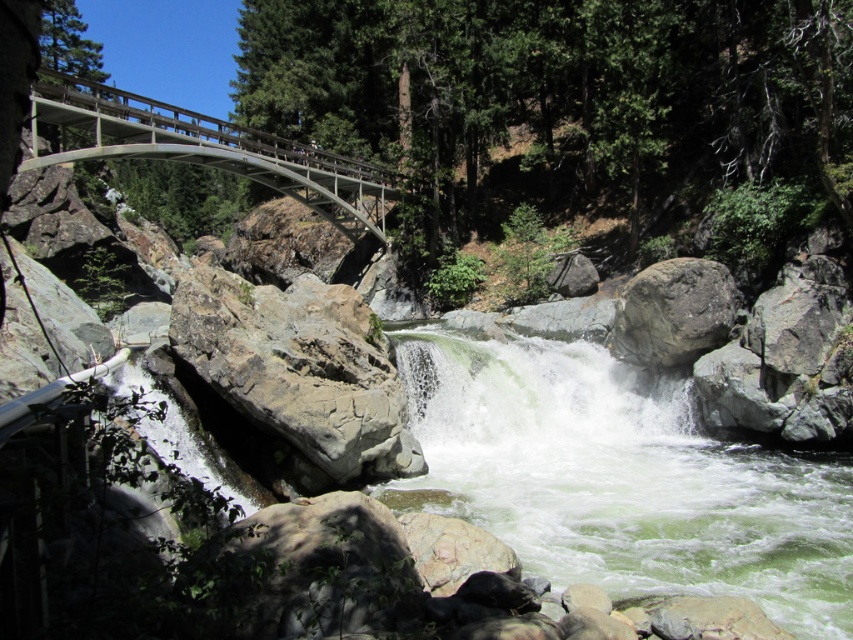
Which is above, rocky gray boulder at center-left or gray rough rock at center-right?

gray rough rock at center-right is higher up.

The image size is (853, 640). What do you see at coordinates (299, 369) in the screenshot? I see `rocky gray boulder at center-left` at bounding box center [299, 369].

Is point (247, 324) closer to camera compared to point (724, 266)?

Yes, point (247, 324) is in front of point (724, 266).

I want to click on rocky gray boulder at center-left, so click(x=299, y=369).

In the scene shown: Between metallic gray bridge at upper left and gray rough rock at center-right, which one is positioned higher?

metallic gray bridge at upper left

This screenshot has height=640, width=853. What do you see at coordinates (207, 148) in the screenshot? I see `metallic gray bridge at upper left` at bounding box center [207, 148].

Locate an element on the screen. metallic gray bridge at upper left is located at coordinates [207, 148].

Who is positioned more to the right, rocky gray boulder at center-left or metallic gray bridge at upper left?

rocky gray boulder at center-left is more to the right.

Is rocky gray boulder at center-left wider than metallic gray bridge at upper left?

Incorrect, rocky gray boulder at center-left's width does not surpass metallic gray bridge at upper left's.

What do you see at coordinates (299, 369) in the screenshot? I see `rocky gray boulder at center-left` at bounding box center [299, 369].

The height and width of the screenshot is (640, 853). I want to click on rocky gray boulder at center-left, so click(x=299, y=369).